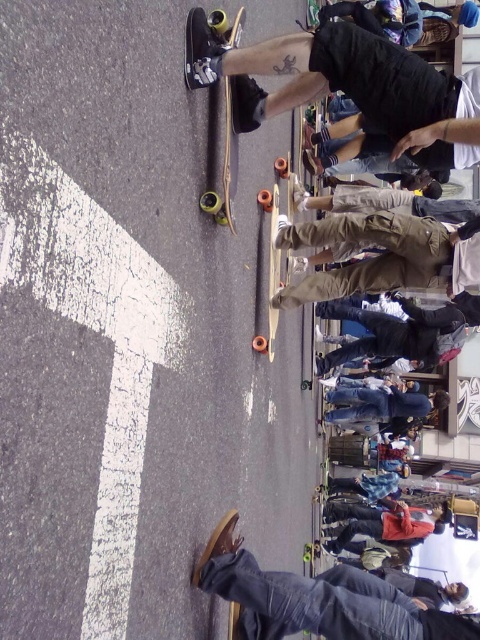
Question: Estimate the real-world distances between objects in this image. Which object is closer to the wooden smooth skateboard at center?

Choices:
 (A) yellow-green rubber skateboard at center
 (B) shiny black skateboard at upper center
 (C) wooden skateboard at upper center

Answer: (C)

Question: Observing the image, what is the correct spatial positioning of shiny black skateboard at upper center in reference to wooden smooth skateboard at center?

Choices:
 (A) left
 (B) right

Answer: (A)

Question: Is wooden skateboard at upper center bigger than yellow-green rubber skateboard at center?

Choices:
 (A) yes
 (B) no

Answer: (B)

Question: Which object is positioned farthest from the wooden smooth skateboard at center?

Choices:
 (A) wooden skateboard at upper center
 (B) shiny black skateboard at upper center

Answer: (B)

Question: Considering the real-world distances, which object is farthest from the wooden skateboard at upper center?

Choices:
 (A) shiny black skateboard at upper center
 (B) yellow-green rubber skateboard at center
 (C) wooden smooth skateboard at center

Answer: (B)

Question: Does wooden smooth skateboard at center lie in front of yellow-green rubber skateboard at center?

Choices:
 (A) yes
 (B) no

Answer: (A)